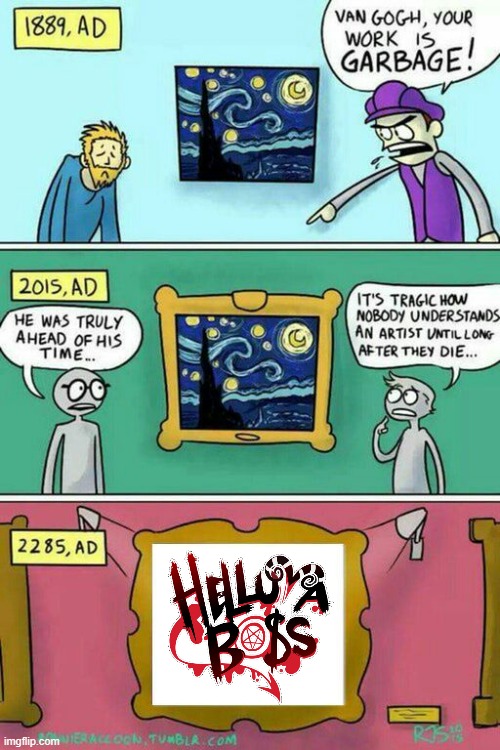
The width and height of the screenshot is (500, 750). Identify the location of spotlight. (409, 520), (84, 514).